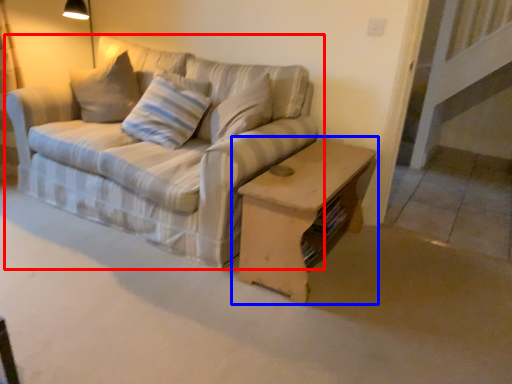
Question: Which point is closer to the camera, studio couch (highlighted by a red box) or table (highlighted by a blue box)?

Choices:
 (A) studio couch
 (B) table

Answer: (A)